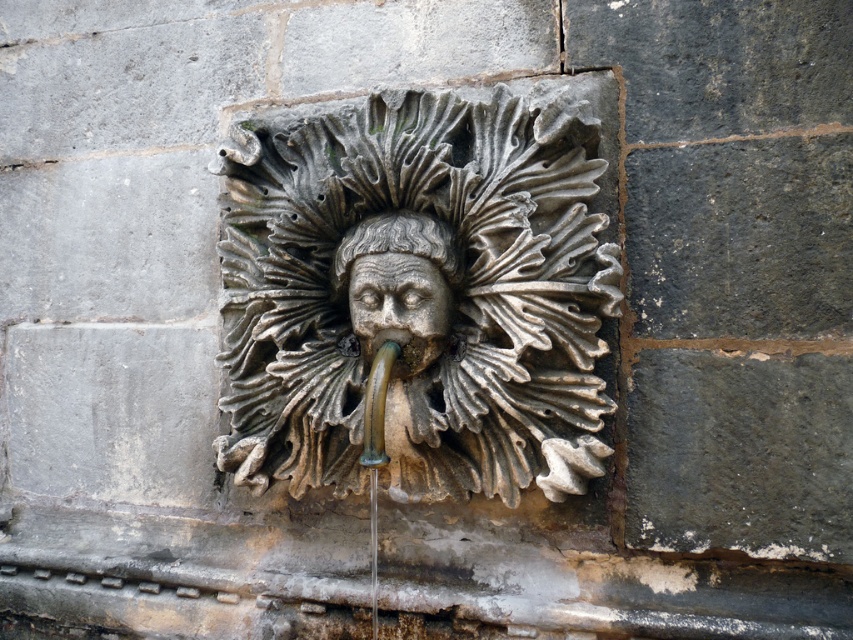
This screenshot has width=853, height=640. I want to click on gray stone mask at center, so click(x=418, y=296).

What do you see at coordinates (418, 296) in the screenshot? Image resolution: width=853 pixels, height=640 pixels. I see `gray stone mask at center` at bounding box center [418, 296].

At what (x,y) coordinates should I click in order to perform the action: click on gray stone mask at center. Please return your answer as a coordinate pair (x, y). This screenshot has height=640, width=853. Looking at the image, I should click on (418, 296).